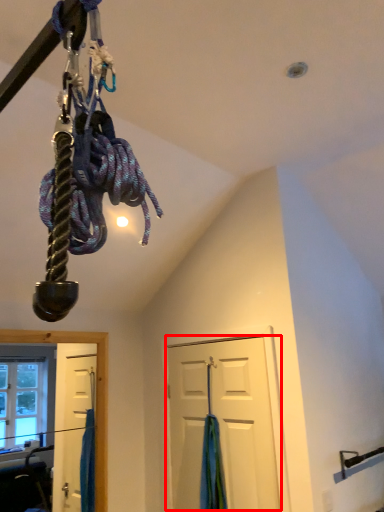
Question: Where is door (annotated by the red box) located in relation to curtain in the image?

Choices:
 (A) right
 (B) left

Answer: (A)